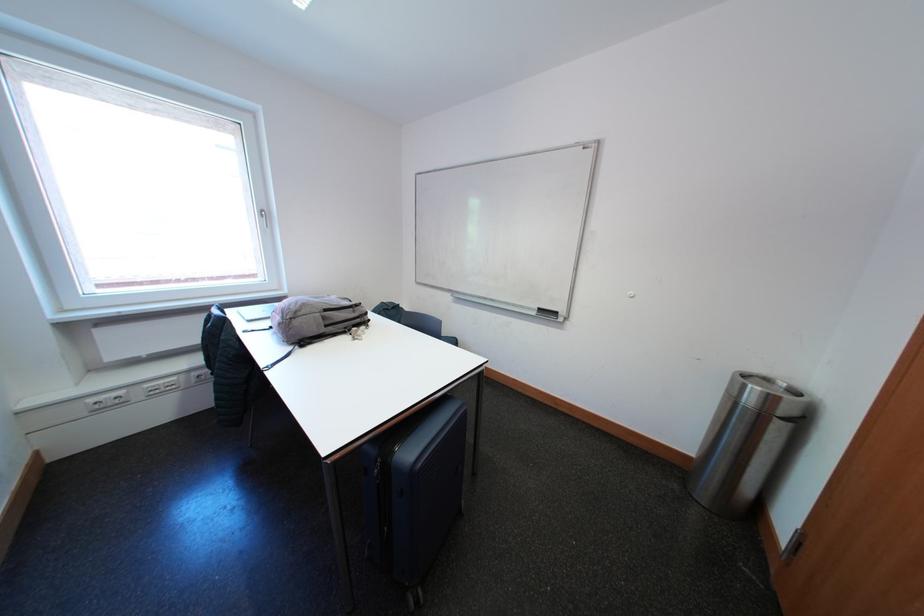
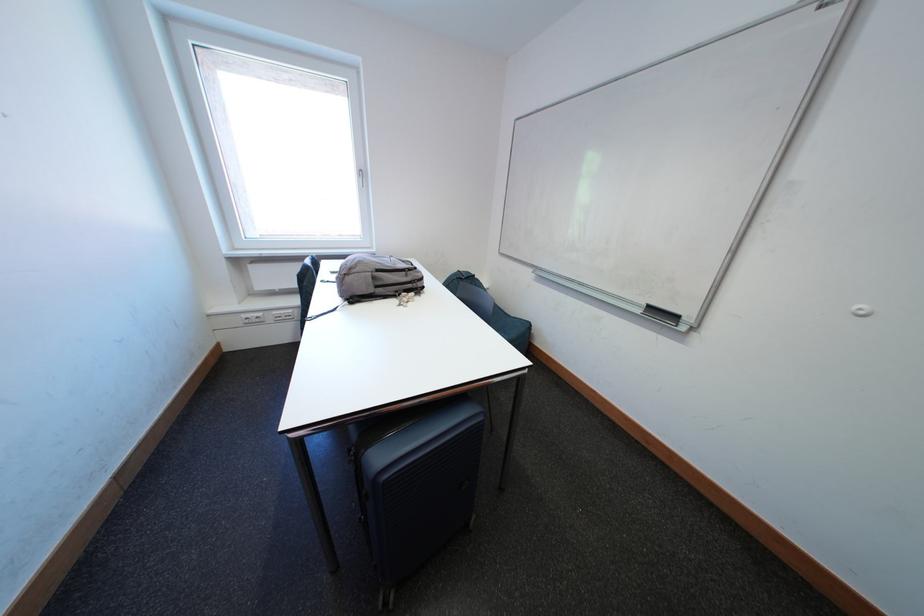
Where in the second image is the point corresponding to (x=355, y=331) from the first image?

(406, 294)